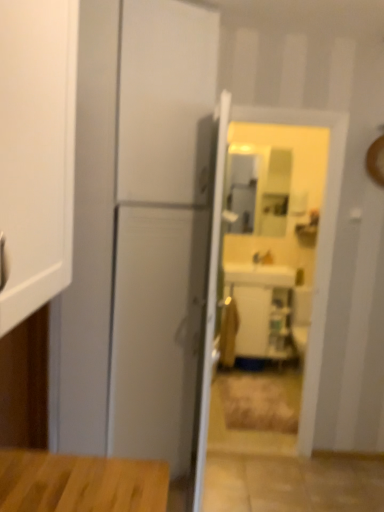
Where is `matte brown cabinet at center`? Image resolution: width=384 pixels, height=512 pixels. matte brown cabinet at center is located at coordinates (263, 322).

The height and width of the screenshot is (512, 384). Describe the element at coordinates (261, 273) in the screenshot. I see `white glossy sink at center` at that location.

Measure the distance between point (282, 286) and camera.

Point (282, 286) and camera are 3.75 meters apart from each other.

Describe the element at coordinates (267, 258) in the screenshot. This screenshot has width=384, height=512. I see `matte silver faucet at center` at that location.

At what (x,y) coordinates should I click in order to perform the action: click on matte brown cabinet at center. Please return your answer as a coordinate pair (x, y). This screenshot has height=512, width=384. Looking at the image, I should click on (263, 322).

Does white glossy sink at center turn towards matte silver faucet at center?

No.

Between point (285, 277) and point (265, 255), which one is positioned behind?

The point (265, 255) is farther from the camera.

Is matte silver faucet at center completely or partially inside white glossy sink at center?

Yes.

Which object is further away from the camera taking this photo, white glossy sink at center or matte silver faucet at center?

matte silver faucet at center is behind.

Which object is closer to the camera taking this photo, white glossy door at center or matte brown cabinet at center?

Positioned in front is white glossy door at center.

In terms of size, does white glossy door at center appear bigger or smaller than matte brown cabinet at center?

In the image, white glossy door at center appears to be larger than matte brown cabinet at center.

From a real-world perspective, between white glossy door at center and matte brown cabinet at center, who is vertically lower?

From a 3D spatial view, matte brown cabinet at center is below.

Between white glossy door at center and matte brown cabinet at center, which one has more height?

With more height is white glossy door at center.

From the image's perspective, between matte silver faucet at center and matte brown cabinet at center, who is located below?

matte brown cabinet at center, from the image's perspective.

Can you confirm if matte silver faucet at center is thinner than matte brown cabinet at center?

Yes.

At what (x,y) coordinates should I click in order to perform the action: click on faucet behind the matte brown cabinet at center. Please return your answer as a coordinate pair (x, y). Looking at the image, I should click on (267, 258).

Which of these two, matte brown cabinet at center or white glossy door at center, is bigger?

white glossy door at center.

Does matte brown cabinet at center have a greater width compared to white glossy door at center?

Correct, the width of matte brown cabinet at center exceeds that of white glossy door at center.

Can you see matte brown cabinet at center touching white glossy door at center?

No, matte brown cabinet at center is not beside white glossy door at center.

This screenshot has height=512, width=384. I want to click on cabinetry located below the white glossy door at center (from the image's perspective), so click(263, 322).

Which object is thinner, white glossy door at center or white glossy sink at center?

white glossy door at center.

From the image's perspective, is white glossy door at center on top of white glossy sink at center?

No.

Is white glossy door at center next to white glossy sink at center and touching it?

No, white glossy door at center is not next to white glossy sink at center.

From a real-world perspective, is matte silver faucet at center below white glossy sink at center?

Actually, matte silver faucet at center is physically above white glossy sink at center in the real world.

Is matte silver faucet at center in contact with white glossy sink at center?

matte silver faucet at center is not next to white glossy sink at center, and they're not touching.

Who is shorter, matte silver faucet at center or white glossy sink at center?

Standing shorter between the two is matte silver faucet at center.

In the scene shown: Does matte silver faucet at center have a lesser height compared to white glossy door at center?

Indeed, matte silver faucet at center has a lesser height compared to white glossy door at center.

From the picture: Is matte silver faucet at center not close to white glossy door at center?

Yes, matte silver faucet at center is far from white glossy door at center.

From the image's perspective, is matte silver faucet at center under white glossy door at center?

No, from the image's perspective, matte silver faucet at center is not beneath white glossy door at center.

How many degrees apart are the facing directions of matte silver faucet at center and white glossy door at center?

The facing directions of matte silver faucet at center and white glossy door at center are 88.9 degrees apart.

I want to click on sink in front of the matte silver faucet at center, so click(261, 273).

You are a GUI agent. You are given a task and a screenshot of the screen. Output one action in this format:
    pyautogui.click(x=<x>, y=<y>)
    Task: Click on the cabinetry behind the white glossy door at center
    Image resolution: width=384 pixels, height=512 pixels.
    Given the screenshot: What is the action you would take?
    pyautogui.click(x=263, y=322)

From the image, which object appears to be farther from matte silver faucet at center, matte brown cabinet at center or white glossy door at center?

white glossy door at center.

Based on their spatial positions, is white glossy sink at center or white glossy door at center further from matte silver faucet at center?

Based on the image, white glossy door at center appears to be further to matte silver faucet at center.

Considering their positions, is matte silver faucet at center positioned closer to white glossy sink at center than white glossy door at center?

matte silver faucet at center.

Which object lies nearer to the anchor point white glossy sink at center, matte silver faucet at center or matte brown cabinet at center?

matte silver faucet at center.

Looking at the image, which one is located further to white glossy door at center, white glossy sink at center or matte brown cabinet at center?

white glossy sink at center lies further to white glossy door at center than the other object.

Estimate the real-world distances between objects in this image. Which object is closer to white glossy door at center, matte brown cabinet at center or white glossy sink at center?

matte brown cabinet at center is positioned closer to the anchor white glossy door at center.

Estimate the real-world distances between objects in this image. Which object is closer to white glossy door at center, white glossy sink at center or matte silver faucet at center?

The object closer to white glossy door at center is white glossy sink at center.

Looking at the image, which one is located further to matte brown cabinet at center, white glossy sink at center or white glossy door at center?

white glossy door at center.

Identify the location of sink positioned between white glossy door at center and matte brown cabinet at center from near to far. This screenshot has width=384, height=512. (261, 273).

I want to click on sink positioned between white glossy door at center and matte silver faucet at center from near to far, so click(261, 273).

Locate an element on the screen. sink that lies between matte silver faucet at center and matte brown cabinet at center from top to bottom is located at coordinates (261, 273).

At what (x,y) coordinates should I click in order to perform the action: click on cabinetry between white glossy door at center and matte silver faucet at center in the front-back direction. Please return your answer as a coordinate pair (x, y). Looking at the image, I should click on (263, 322).